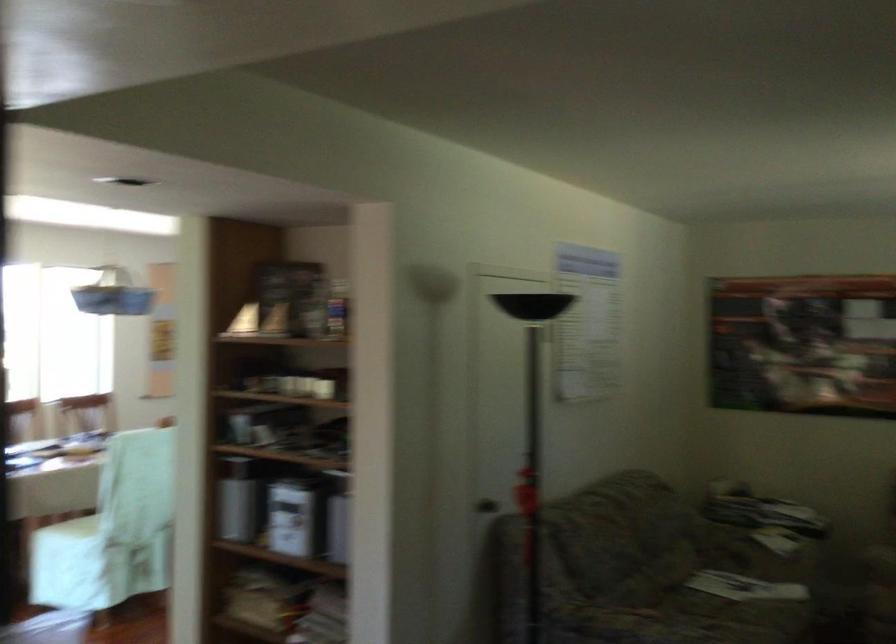
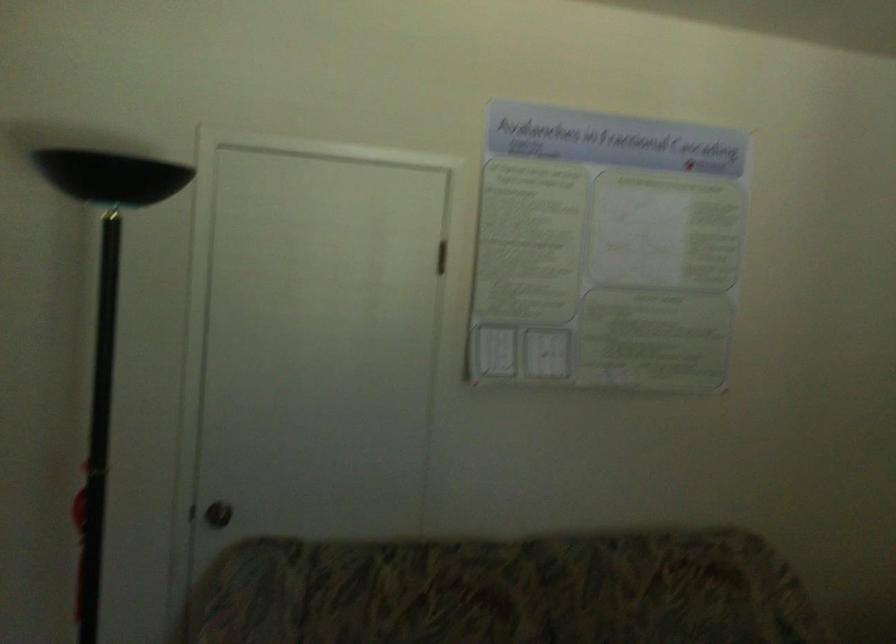
The point at (476, 488) is marked in the first image. Where is the corresponding point in the second image?

(218, 514)